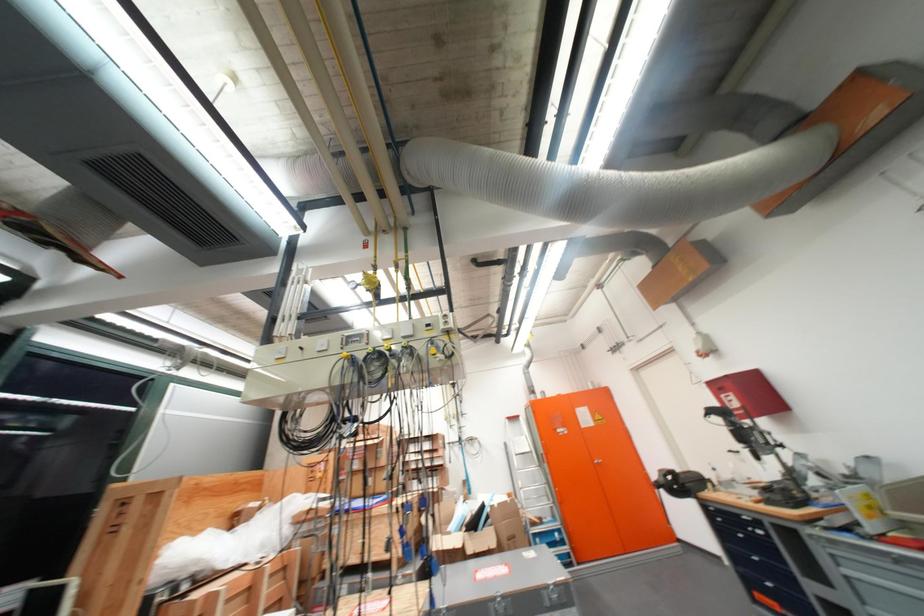
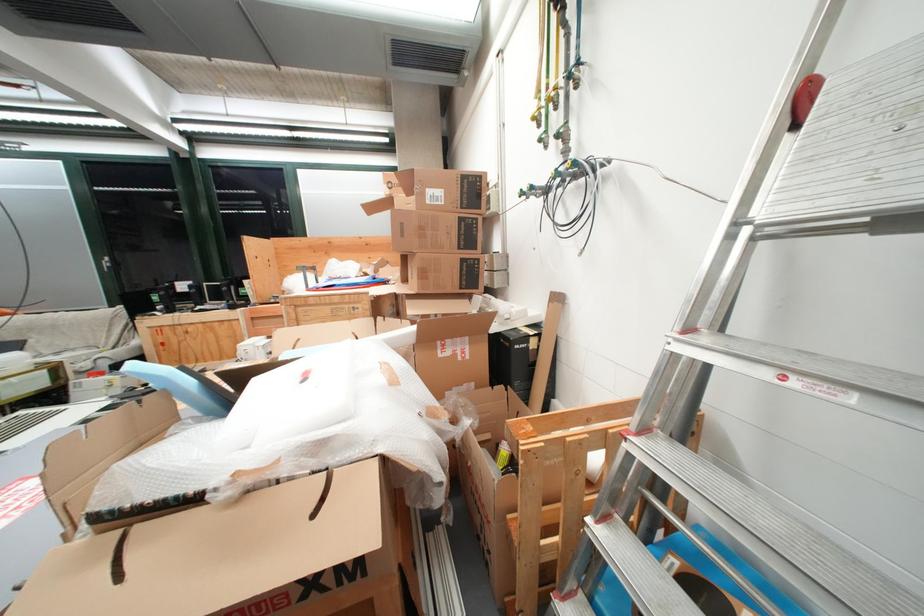
Question: I am providing you with two images of the same scene from different viewpoints. Please identify which objects are invisible in image2.

Choices:
 (A) green valve dial
 (B) cardboard box
 (C) black wheeled bin
 (D) black computer case

Answer: (B)